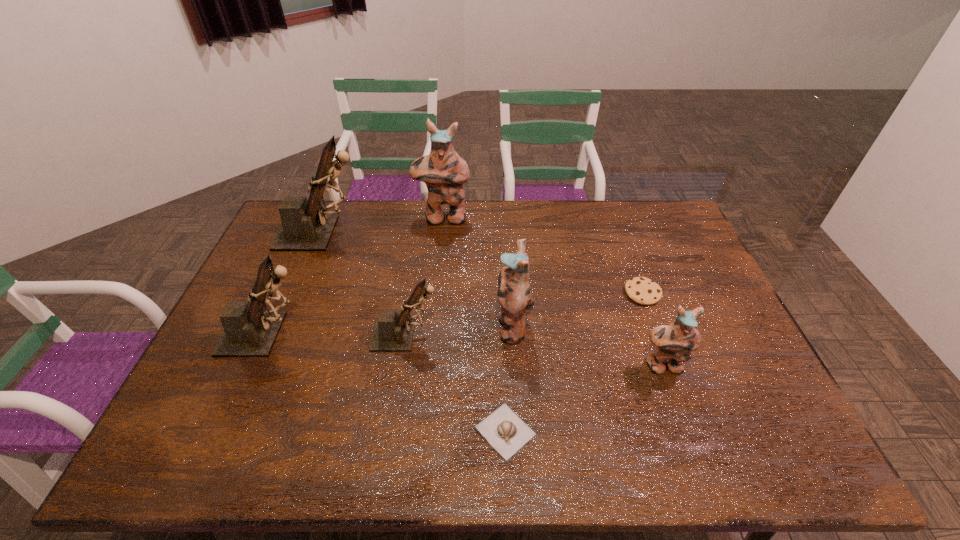
Find the location of a particular element. the seventh tallest object is located at coordinates (641, 290).

Identify the location of the shortest object. coord(503,429).

Locate an element on the screen. the nearest object is located at coordinates (503, 429).

Locate an element on the screen. free spot located on the front-facing side of the biggest pink figurine is located at coordinates (435, 301).

I want to click on blank space located 0.370m on the front-facing side of the biggest brown figurine, so click(x=470, y=233).

At what (x,y) coordinates should I click in order to perform the action: click on vacant space located on the front-facing side of the second smallest brown figurine. Please return your answer as a coordinate pair (x, y). This screenshot has height=540, width=960. Looking at the image, I should click on pos(425,334).

Identify the location of vacant space located 0.160m on the front-facing side of the second farthest pink figurine. The width and height of the screenshot is (960, 540). (440, 326).

At what (x,y) coordinates should I click in order to perform the action: click on free location located on the front-facing side of the second farthest pink figurine. Please return your answer as a coordinate pair (x, y). This screenshot has width=960, height=540. Looking at the image, I should click on (440, 326).

What are the coordinates of `free spot located on the front-facing side of the second farthest pink figurine` in the screenshot? It's located at (420, 326).

The width and height of the screenshot is (960, 540). In order to click on free spot located 0.350m on the front-facing side of the rightmost brown figurine in this screenshot , I will do point(564,335).